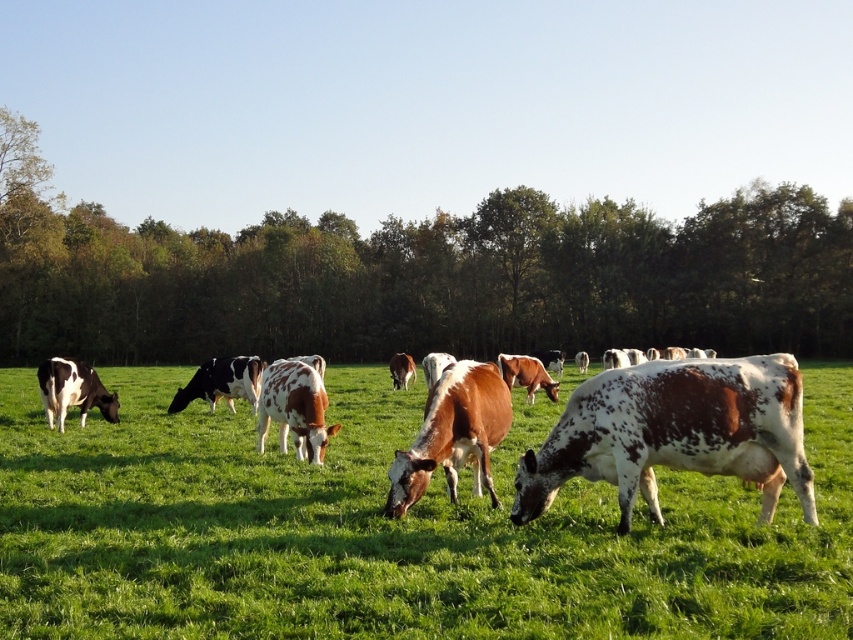
Question: Can you confirm if brown speckled cow at center is thinner than spotted white cow at left?

Choices:
 (A) no
 (B) yes

Answer: (B)

Question: Which object appears closest to the camera in this image?

Choices:
 (A) speckled brown cow at center
 (B) green leafy tree at center

Answer: (A)

Question: Which object is farther from the camera taking this photo?

Choices:
 (A) black and white spotted cow at center
 (B) green leafy tree at center
 (C) brown speckled cow at center

Answer: (B)

Question: Is brown speckled cow at center wider than spotted white cow at left?

Choices:
 (A) no
 (B) yes

Answer: (A)

Question: Which point appears closest to the camera in this image?

Choices:
 (A) (502, 426)
 (B) (105, 600)
 (C) (212, 264)
 (D) (624, 520)

Answer: (B)

Question: Does green leafy tree at center have a smaller size compared to speckled brown cow at center?

Choices:
 (A) yes
 (B) no

Answer: (B)